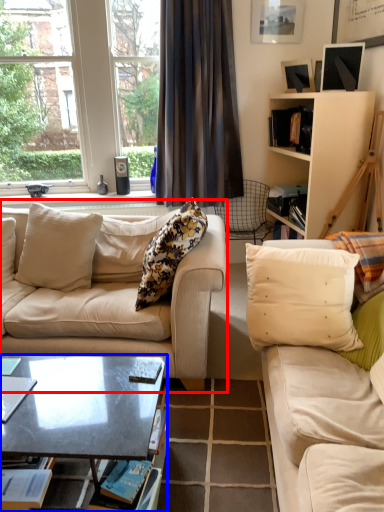
Question: Which of the following is the farthest to the observer, studio couch (highlighted by a red box) or coffee table (highlighted by a blue box)?

Choices:
 (A) studio couch
 (B) coffee table

Answer: (A)